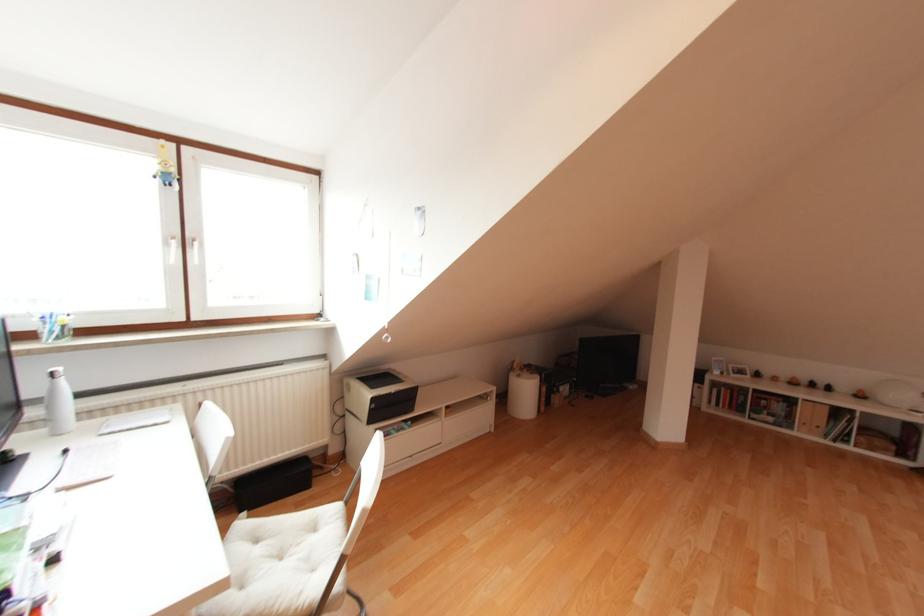
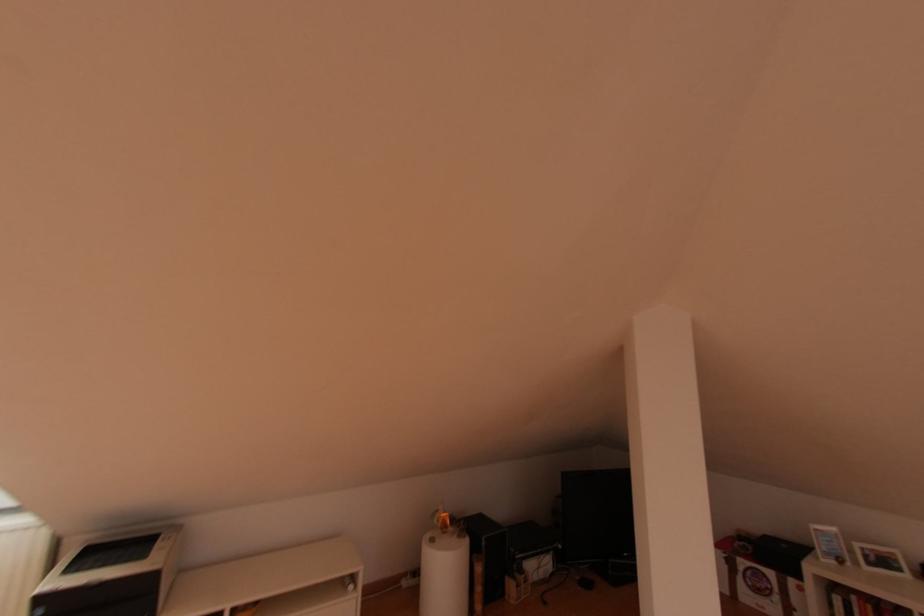
In the second image, find the point that corresponds to [555,400] in the first image.

(511, 589)